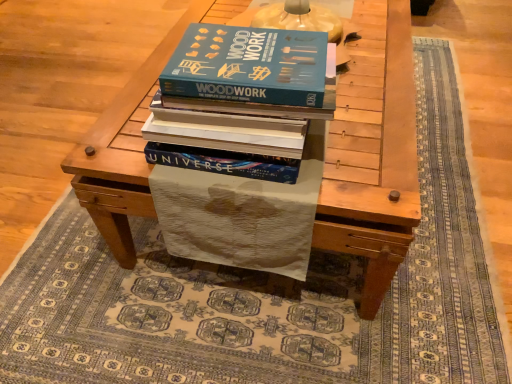
Find the location of a particular element. vacant area located to the right-hand side of blue hardcover book at center is located at coordinates (370, 131).